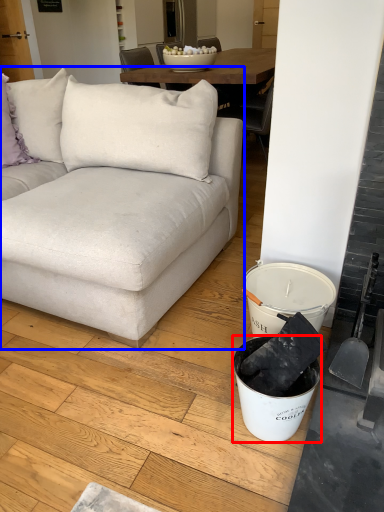
Question: Which of the following is the closest to the observer, bucket (highlighted by a red box) or studio couch (highlighted by a blue box)?

Choices:
 (A) bucket
 (B) studio couch

Answer: (B)